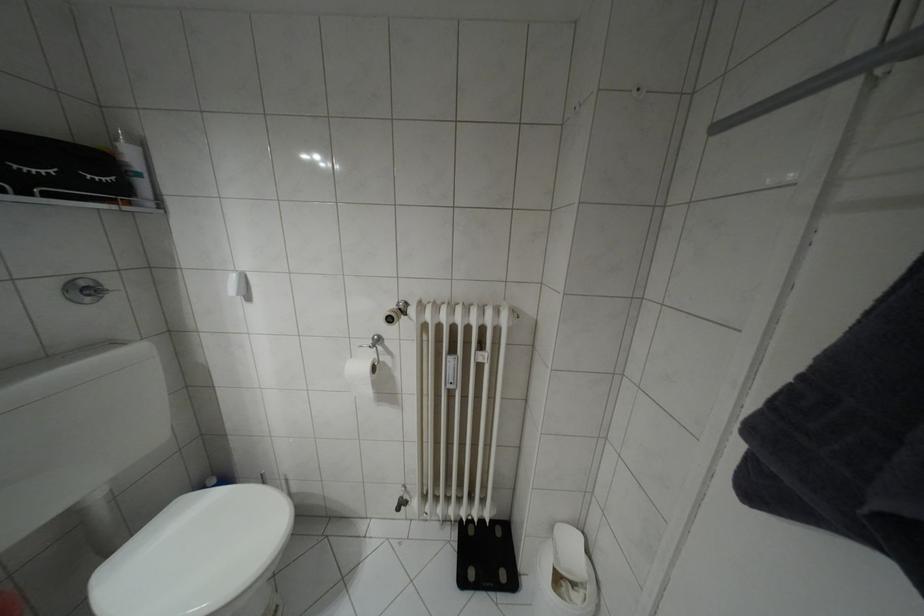
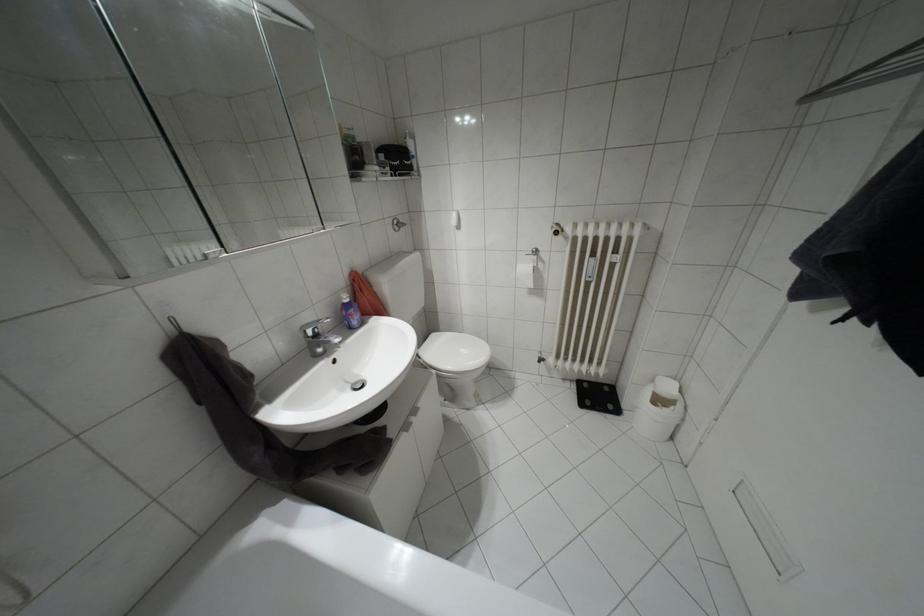
In the second image, find the point that corresponds to point (369, 392) in the first image.

(530, 284)